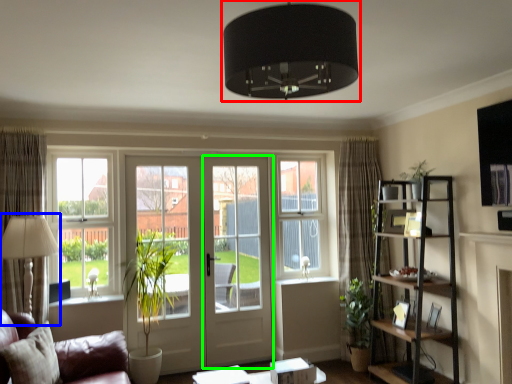
Question: Based on their relative distances, which object is nearer to lamp (highlighted by a red box)? Choose from table lamp (highlighted by a blue box) and screen door (highlighted by a green box).

Choices:
 (A) table lamp
 (B) screen door

Answer: (A)